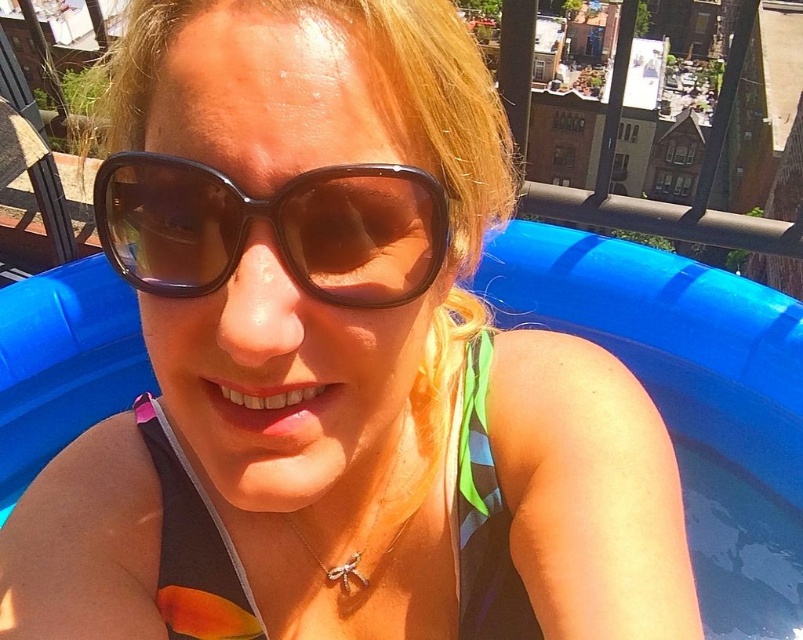
Question: Considering the relative positions of brown shiny sunglasses at center and black matte bikini top at center in the image provided, where is brown shiny sunglasses at center located with respect to black matte bikini top at center?

Choices:
 (A) right
 (B) left

Answer: (B)

Question: Which of the following is the farthest from the observer?

Choices:
 (A) (x=263, y=218)
 (B) (x=176, y=561)

Answer: (B)

Question: Which point is closer to the camera?

Choices:
 (A) black matte bikini top at center
 (B) brown shiny sunglasses at center

Answer: (B)

Question: Does brown shiny sunglasses at center appear over black matte bikini top at center?

Choices:
 (A) yes
 (B) no

Answer: (A)

Question: Does brown shiny sunglasses at center appear under black matte bikini top at center?

Choices:
 (A) yes
 (B) no

Answer: (B)